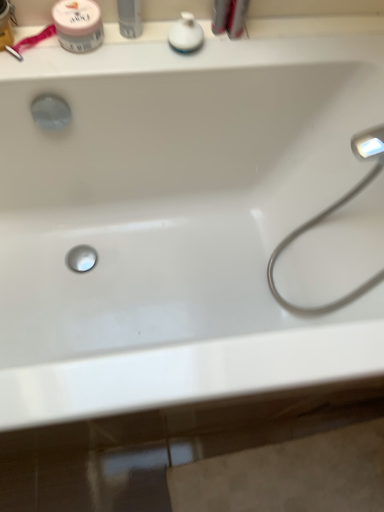
The image size is (384, 512). Identify the location of vacant region to the left of white glossy soap dispenser at upper center, which is counted as the 2th toiletry, starting from the left. (126, 50).